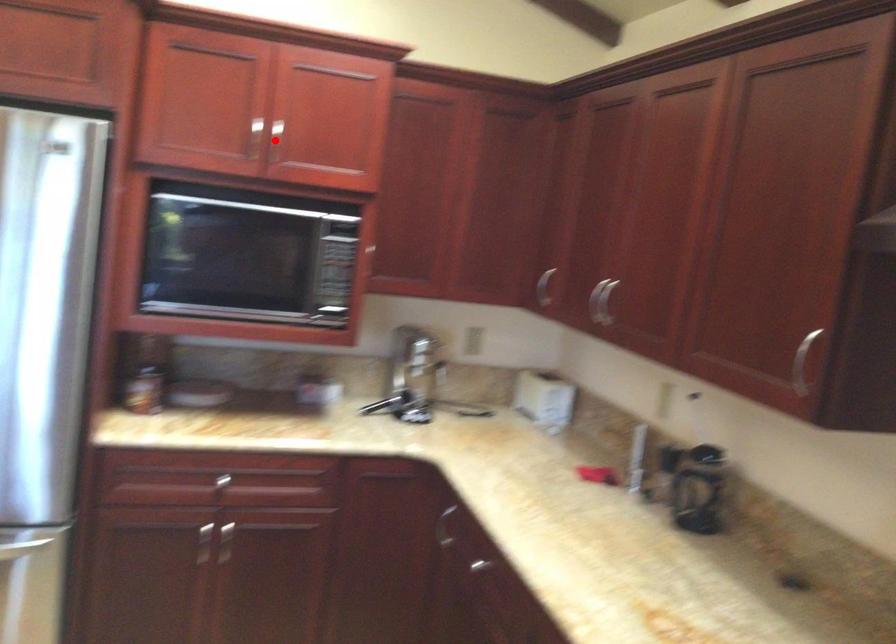
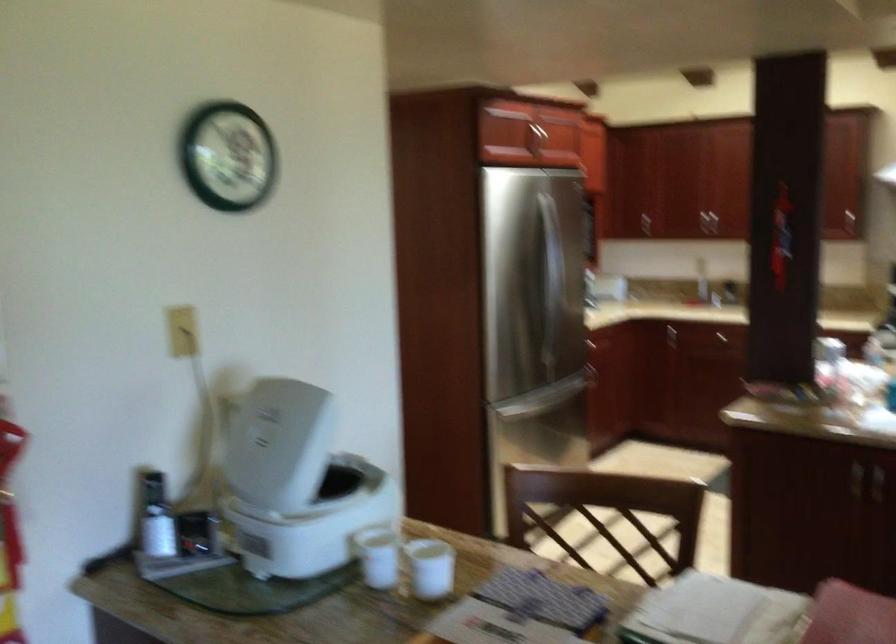
Question: I am providing you with two images of the same scene from different viewpoints. A red point is marked on the first image. At the location where the point appears in image 1, is it still visible in image 2?

Choices:
 (A) Yes
 (B) No

Answer: (B)